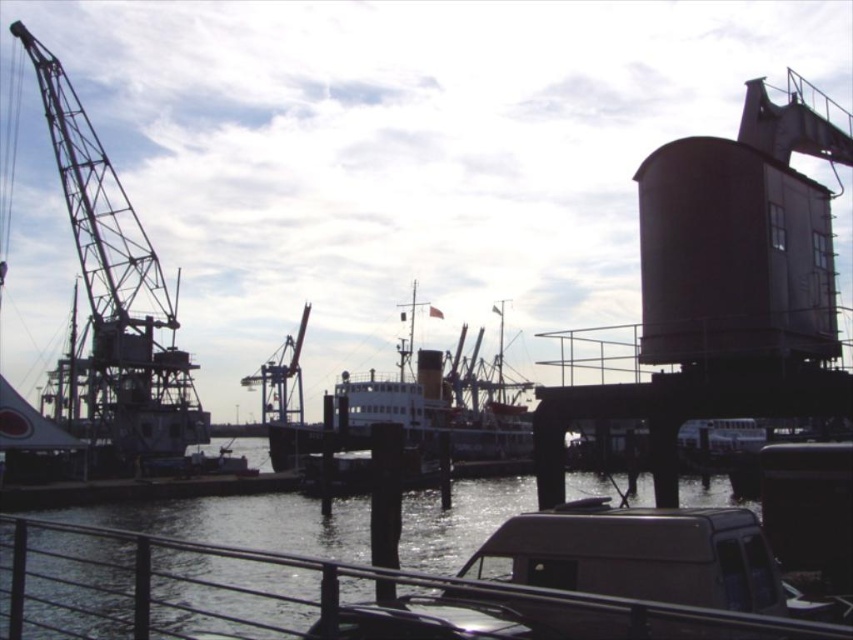
Question: Which object is positioned farthest from the clear water at lower center?

Choices:
 (A) white matte ship at center
 (B) metallic industrial crane at left

Answer: (B)

Question: Among these objects, which one is nearest to the camera?

Choices:
 (A) metallic industrial crane at center
 (B) white matte ship at center

Answer: (B)

Question: Can you confirm if metallic industrial crane at left is positioned to the right of metallic industrial crane at center?

Choices:
 (A) no
 (B) yes

Answer: (A)

Question: From the image, what is the correct spatial relationship of metallic industrial crane at left in relation to white matte ship at center?

Choices:
 (A) left
 (B) right

Answer: (A)

Question: Which object is closer to the camera taking this photo?

Choices:
 (A) metallic industrial crane at center
 (B) metallic industrial crane at left
 (C) clear water at lower center

Answer: (C)

Question: From the image, what is the correct spatial relationship of metallic industrial crane at left in relation to metallic industrial crane at center?

Choices:
 (A) above
 (B) below

Answer: (A)